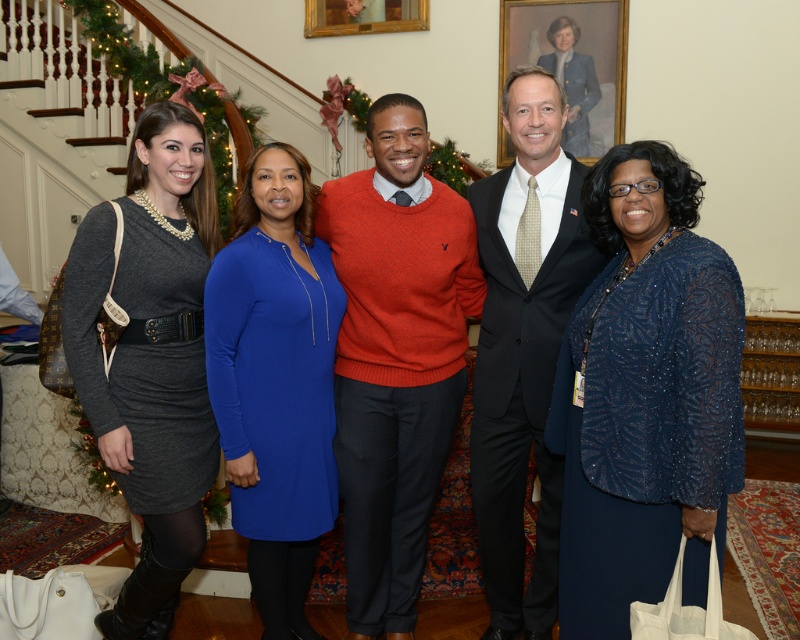
Looking at this image, does orange sweater at center have a lesser height compared to blue dress at center?

Incorrect, orange sweater at center's height does not fall short of blue dress at center's.

Is point (417, 483) in front of point (293, 385)?

No, (417, 483) is behind (293, 385).

This screenshot has height=640, width=800. What do you see at coordinates (396, 356) in the screenshot?
I see `orange sweater at center` at bounding box center [396, 356].

Where is `orange sweater at center`? orange sweater at center is located at coordinates (396, 356).

Can you confirm if orange sweater at center is thinner than matte blue dress at center?

No.

Identify the location of orange sweater at center. (396, 356).

This screenshot has height=640, width=800. Find the location of `orange sweater at center`. orange sweater at center is located at coordinates (396, 356).

Is sparkly blue dress at right positioned before orange sweater at center?

That is True.

Is sparkly blue dress at right shorter than orange sweater at center?

Indeed, sparkly blue dress at right has a lesser height compared to orange sweater at center.

You are a GUI agent. You are given a task and a screenshot of the screen. Output one action in this format:
    pyautogui.click(x=<x>, y=<y>)
    Task: Click on the sparkly blue dress at right
    This screenshot has width=800, height=640.
    Given the screenshot: What is the action you would take?
    pyautogui.click(x=645, y=396)